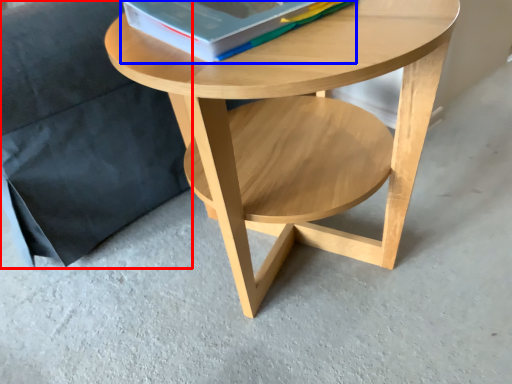
Question: Which point is closer to the camera, armchair (highlighted by a red box) or paperback book (highlighted by a blue box)?

Choices:
 (A) armchair
 (B) paperback book

Answer: (B)